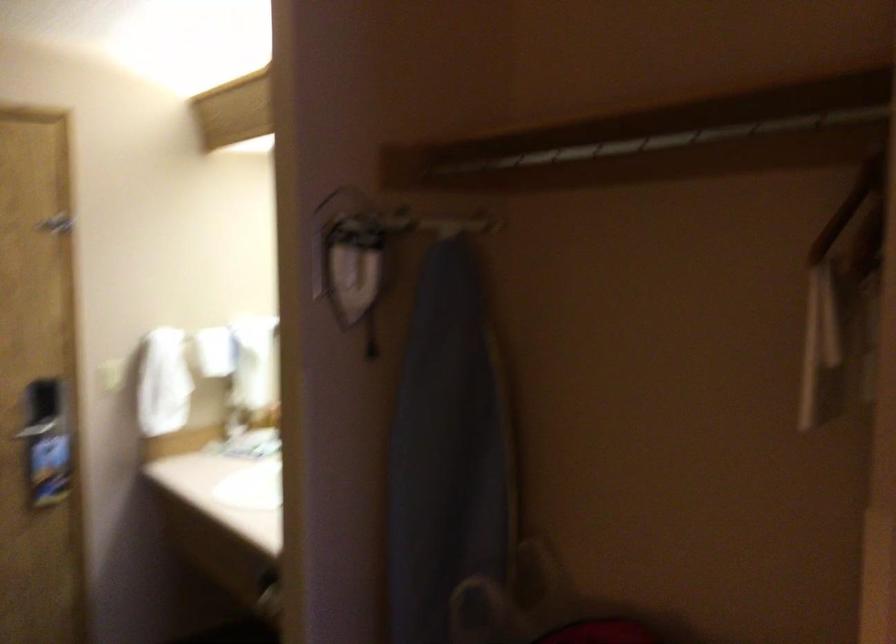
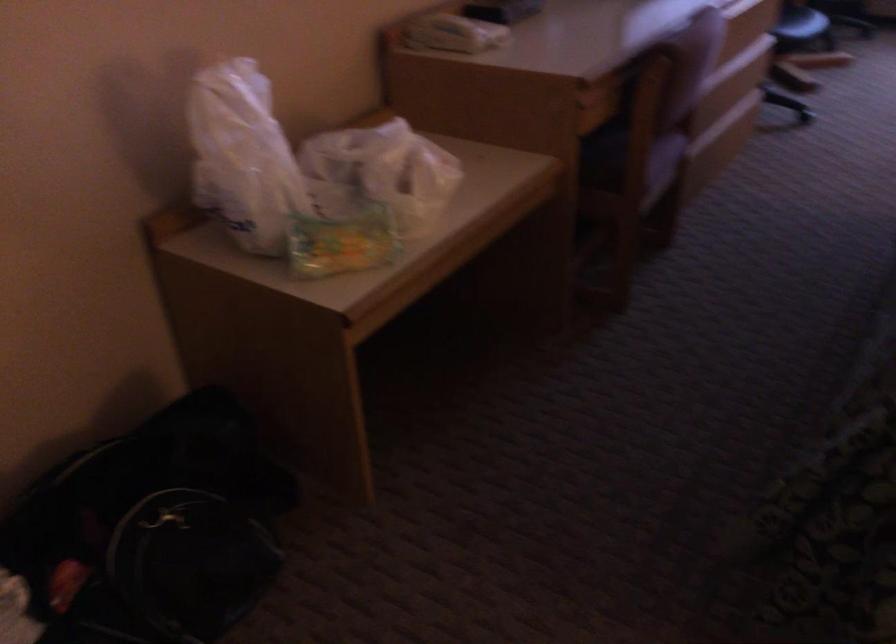
Based on the continuous images, in which direction is the camera rotating?

The camera's rotation is toward right-down.